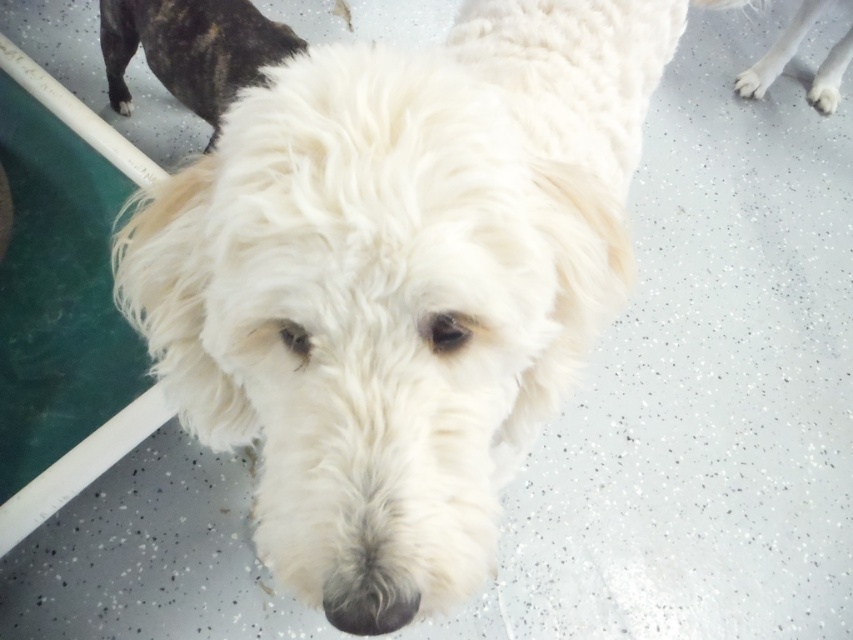
Does black speckled fur at upper left come behind white fluffy dog at upper right?

That is False.

Does black speckled fur at upper left come in front of white fluffy dog at upper right?

Yes, it is in front of white fluffy dog at upper right.

Which is in front, point (250, 20) or point (759, 86)?

Point (250, 20)

The width and height of the screenshot is (853, 640). Identify the location of black speckled fur at upper left. (192, 49).